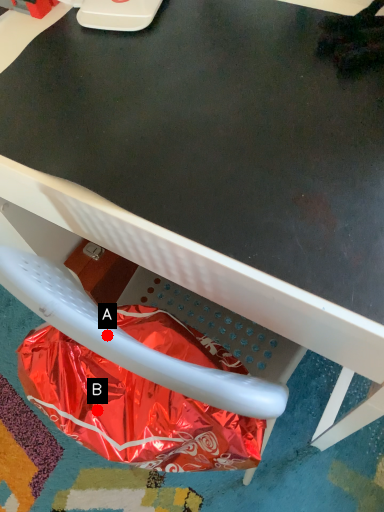
Question: Two points are circled on the image, labeled by A and B beside each circle. Which point appears closest to the camera in this image?

Choices:
 (A) A is closer
 (B) B is closer

Answer: (A)